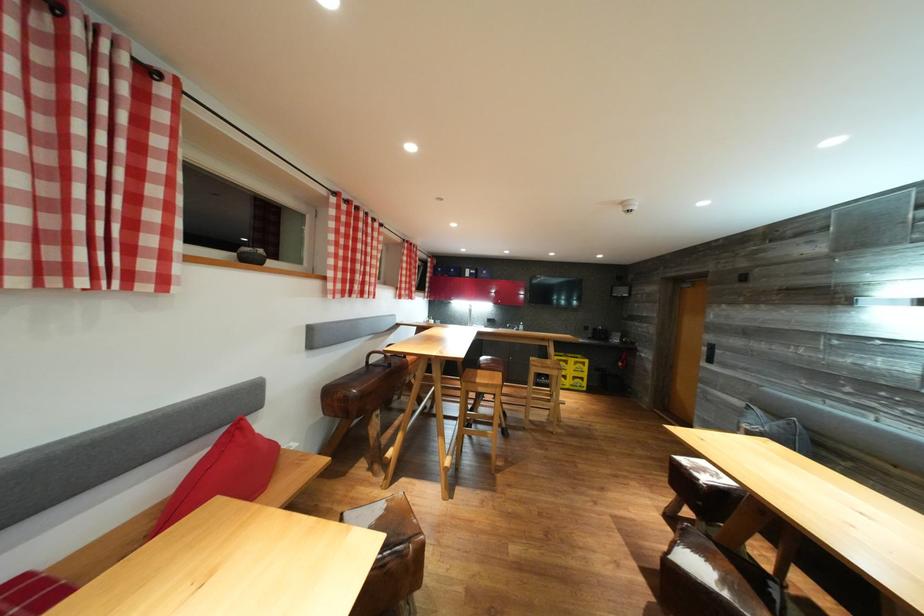
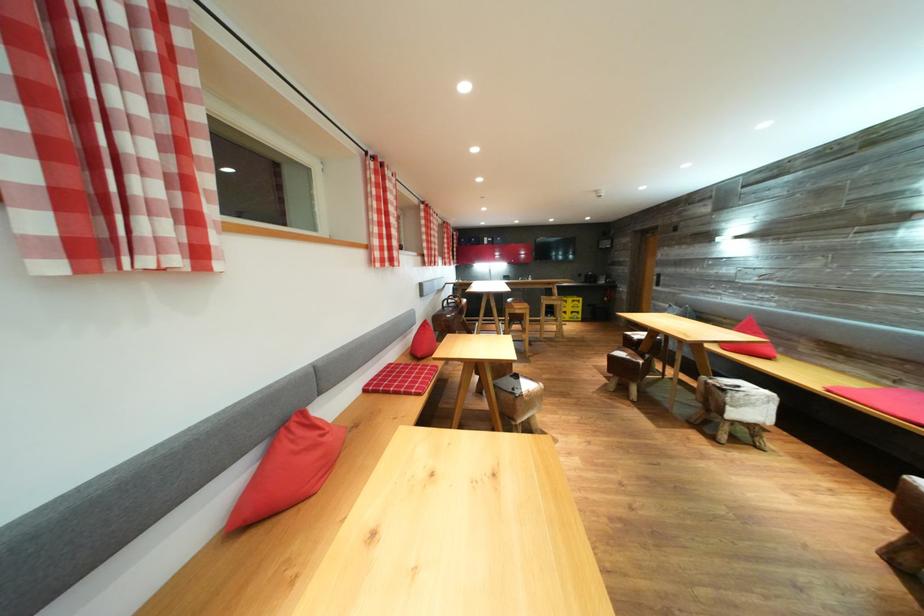
Locate, in the second image, the point that corresponds to (x=578, y=366) in the first image.

(577, 305)